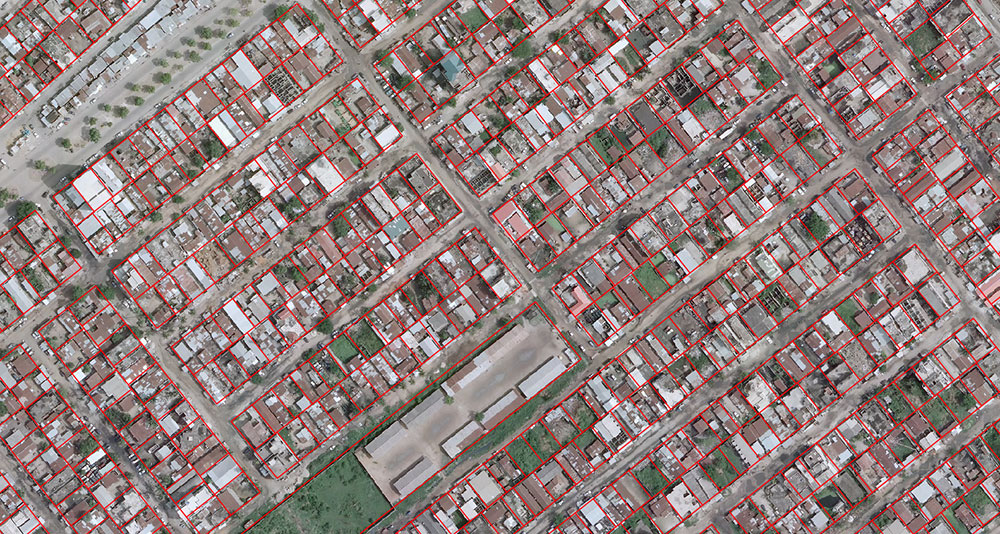
Where is `white roof`? The width and height of the screenshot is (1000, 534). white roof is located at coordinates (89, 183).